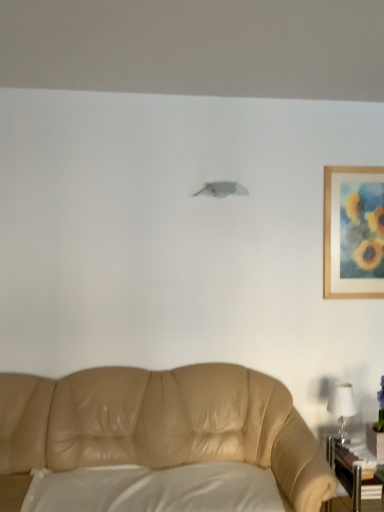
Question: Is point (344, 407) closer or farther from the camera than point (354, 480)?

Choices:
 (A) closer
 (B) farther

Answer: (B)

Question: Is white glossy table lamp at right inside or outside of metallic silver table at lower right?

Choices:
 (A) outside
 (B) inside

Answer: (A)

Question: Which object is the closest to the white matte lampshade at upper center?

Choices:
 (A) tan leather couch at lower left
 (B) white matte pillow at lower center
 (C) metallic silver table at lower right
 (D) wooden framed painting at upper right
 (E) white glossy table lamp at right

Answer: (D)

Question: Estimate the real-world distances between objects in this image. Which object is farther from the metallic silver table at lower right?

Choices:
 (A) white matte lampshade at upper center
 (B) wooden framed painting at upper right
 (C) tan leather couch at lower left
 (D) white glossy table lamp at right
 (E) white matte pillow at lower center

Answer: (A)